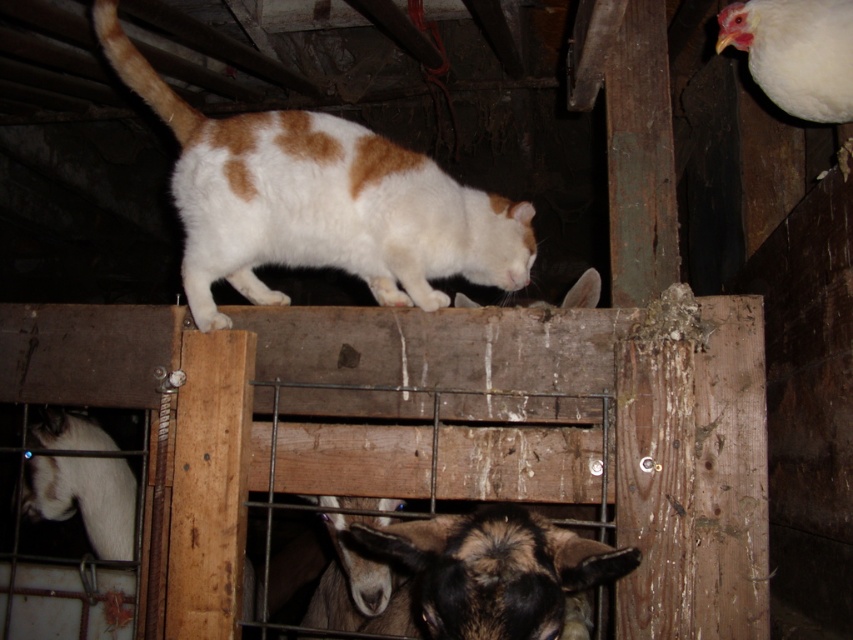
Question: Which is farther from the brown fuzzy goat at lower center?

Choices:
 (A) white fur cat at upper center
 (B) white woolen goat at lower left

Answer: (B)

Question: Which object is farther from the camera taking this photo?

Choices:
 (A) white woolen goat at lower left
 (B) white fur cat at upper center
 (C) brown fuzzy goat at lower center

Answer: (A)

Question: Considering the relative positions of brown fuzzy goat at lower center and white woolen goat at lower left in the image provided, where is brown fuzzy goat at lower center located with respect to white woolen goat at lower left?

Choices:
 (A) right
 (B) left

Answer: (A)

Question: Is brown fuzzy goat at lower center bigger than white woolen goat at lower left?

Choices:
 (A) no
 (B) yes

Answer: (B)

Question: Which point is farther to the camera?

Choices:
 (A) (90, 440)
 (B) (560, 536)
 (C) (207, 118)

Answer: (A)

Question: Is brown fuzzy goat at lower center smaller than white woolen goat at lower left?

Choices:
 (A) yes
 (B) no

Answer: (B)